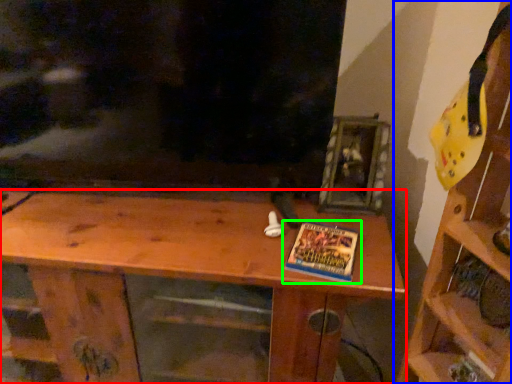
Question: Which object is the farthest from shelf (highlighted by a red box)? Choose among these: shelf (highlighted by a blue box) or book (highlighted by a green box).

Choices:
 (A) shelf
 (B) book

Answer: (A)